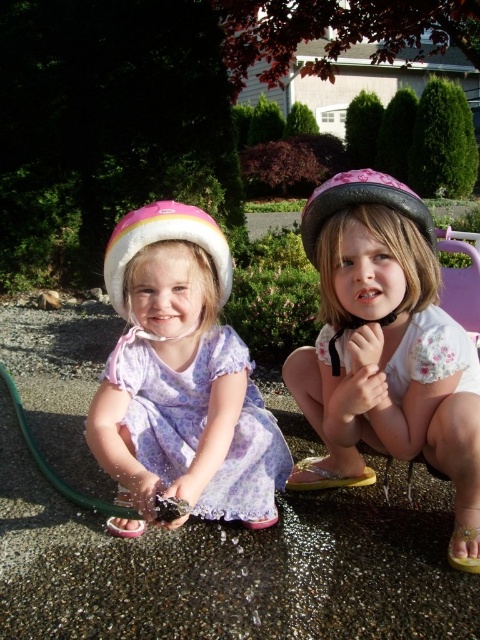
Question: From the image, what is the correct spatial relationship of lavender floral dress at center in relation to yellow rubber sandal at lower center?

Choices:
 (A) below
 (B) above

Answer: (B)

Question: Among these objects, which one is farthest from the camera?

Choices:
 (A) yellow fabric sandal at lower right
 (B) lavender floral dress at center
 (C) yellow rubber sandal at lower center

Answer: (C)

Question: Is yellow rubber sandal at lower center wider than yellow fabric sandal at lower right?

Choices:
 (A) yes
 (B) no

Answer: (A)

Question: Considering the real-world distances, which object is farthest from the lavender floral dress at center?

Choices:
 (A) yellow rubber sandal at lower center
 (B) pink glossy helmet at center
 (C) yellow fabric sandal at lower right

Answer: (C)

Question: Considering the real-world distances, which object is farthest from the yellow fabric sandal at lower right?

Choices:
 (A) pink glossy helmet at center
 (B) yellow rubber sandal at lower center

Answer: (B)

Question: Does pink glossy helmet at center have a smaller size compared to lavender floral dress at center?

Choices:
 (A) yes
 (B) no

Answer: (B)